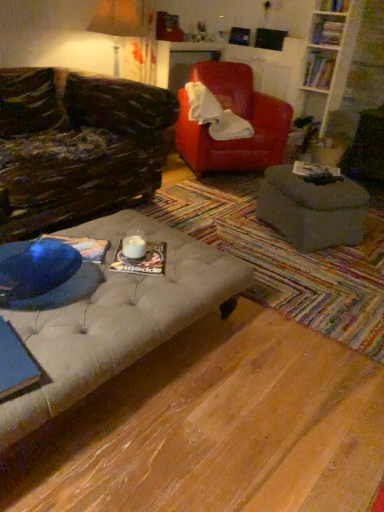
Identify the location of free space above blue paper at center, the 1th book from the left (from a real-world perspective). (77, 244).